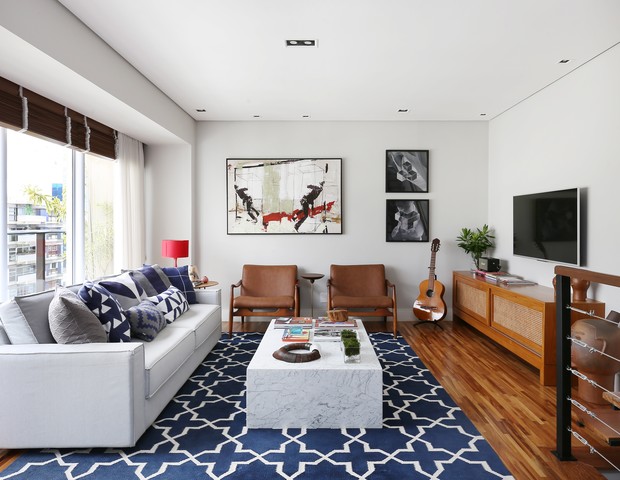
I want to click on marble, so click(x=348, y=390).